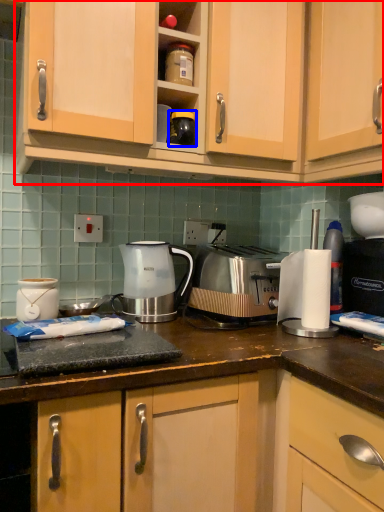
Question: Among these objects, which one is nearest to the camera, cabinetry (highlighted by a red box) or appliance (highlighted by a blue box)?

Choices:
 (A) cabinetry
 (B) appliance

Answer: (A)